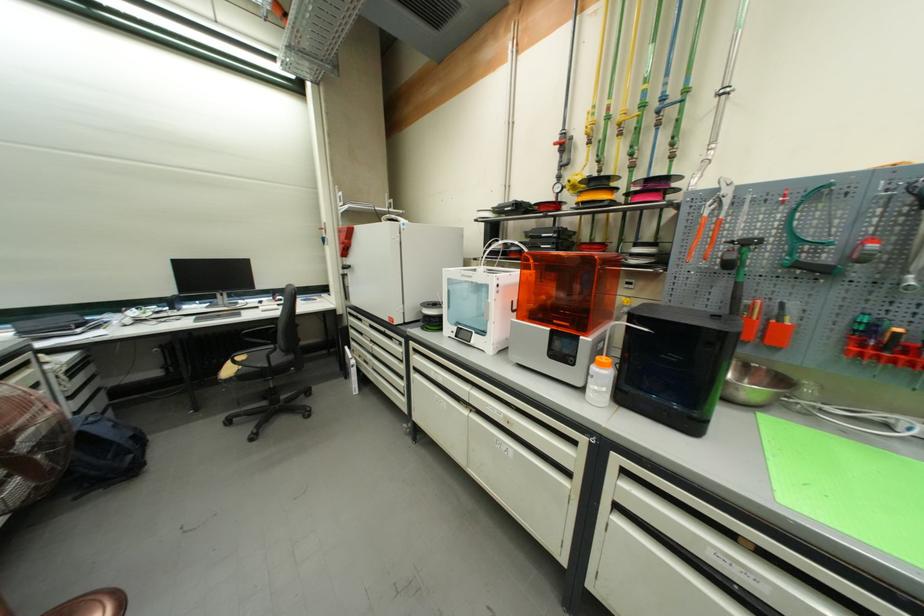
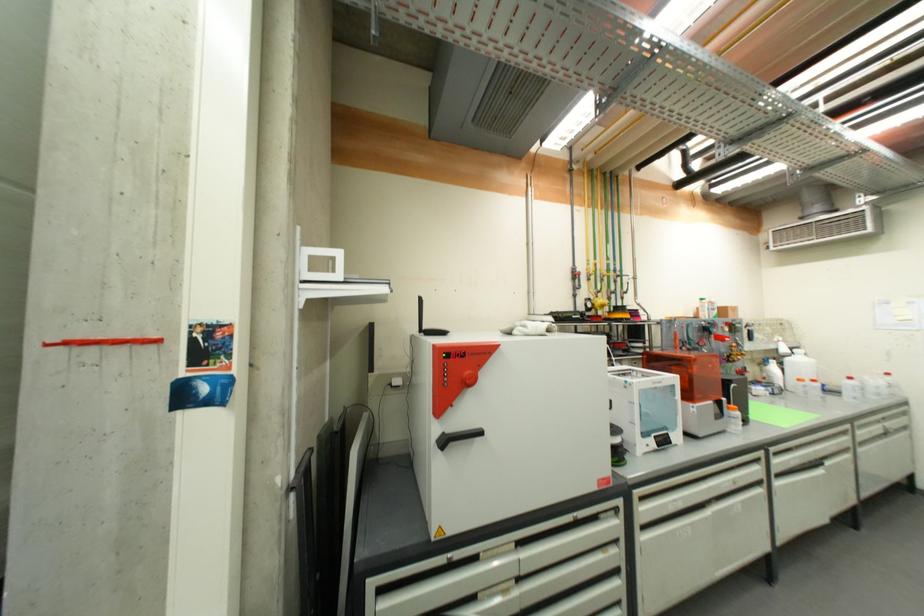
Find the pixel in the second image that matches (x=606, y=367) in the first image.

(739, 411)